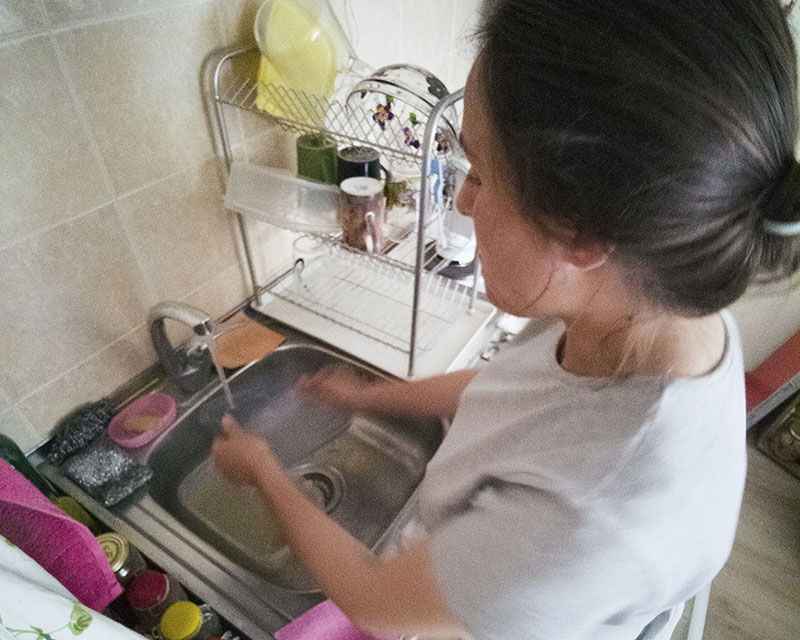
Locate an element on the screen. The image size is (800, 640). dish scrubbie is located at coordinates (114, 475), (73, 438).